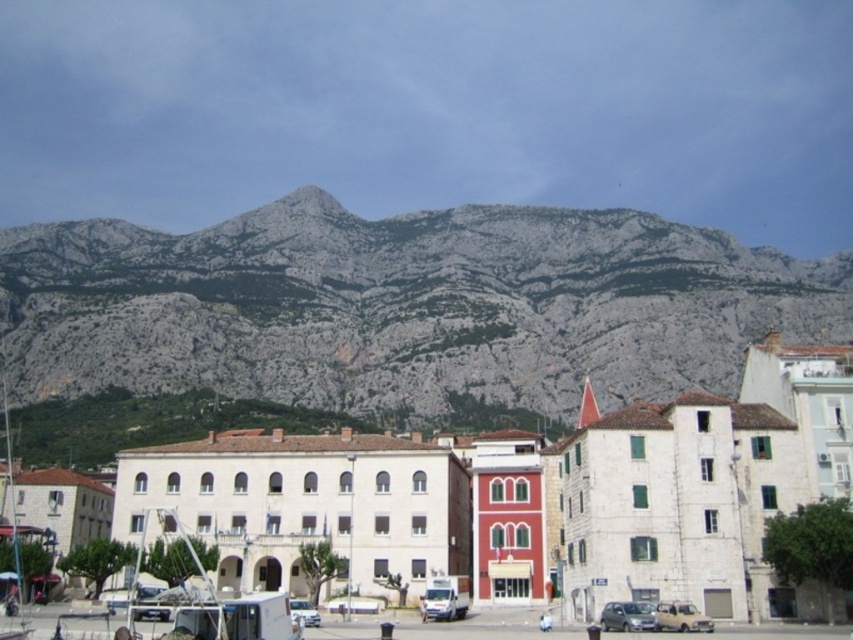
Can you confirm if satin silver car at lower center is positioned to the right of light brown matte car at lower right?

No, satin silver car at lower center is not to the right of light brown matte car at lower right.

Can you confirm if satin silver car at lower center is positioned above light brown matte car at lower right?

Yes, satin silver car at lower center is above light brown matte car at lower right.

Identify the location of satin silver car at lower center. (625, 616).

Can you confirm if gray rock mountain at upper center is smaller than white matte van at center?

No.

Is point (604, 211) less distant than point (299, 598)?

No.

Find the location of `gray rock mountain at upper center`. gray rock mountain at upper center is located at coordinates (402, 305).

Does point (15, 292) lie in front of point (641, 627)?

That is False.

Can you confirm if gray rock mountain at upper center is positioned to the left of satin silver car at lower center?

No, gray rock mountain at upper center is not to the left of satin silver car at lower center.

At what (x,y) coordinates should I click in order to perform the action: click on gray rock mountain at upper center. Please return your answer as a coordinate pair (x, y). This screenshot has height=640, width=853. Looking at the image, I should click on point(402,305).